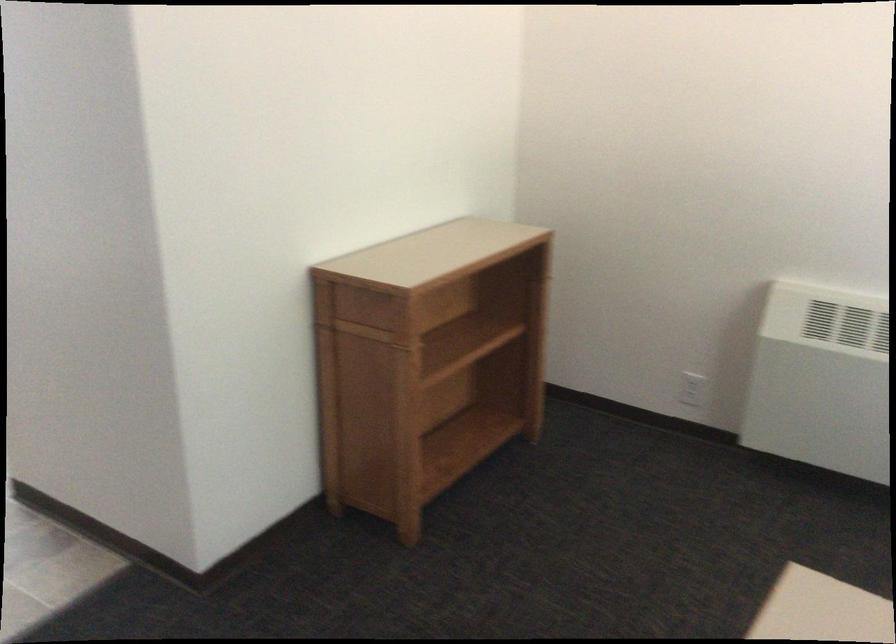
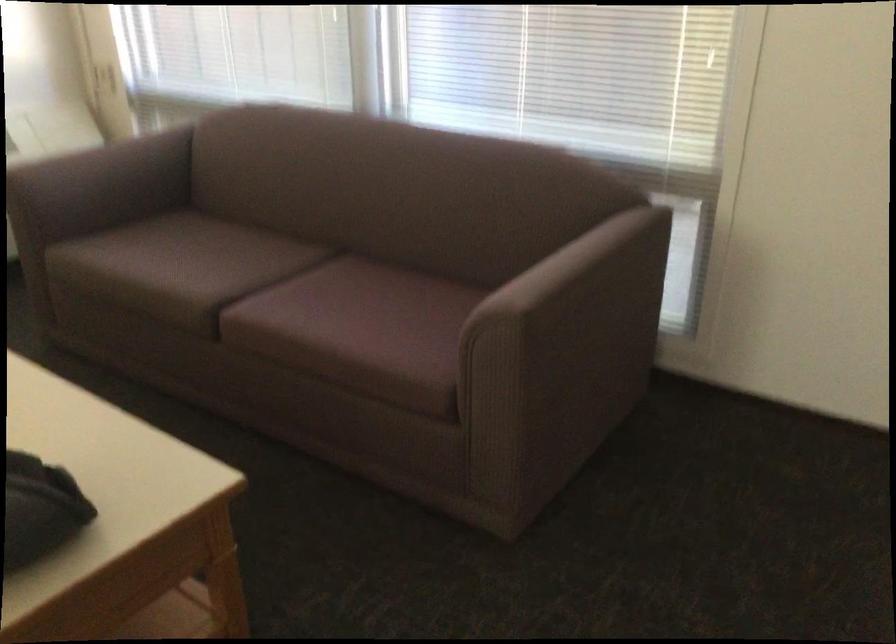
How did the camera likely rotate?

The camera rotated toward right-down.